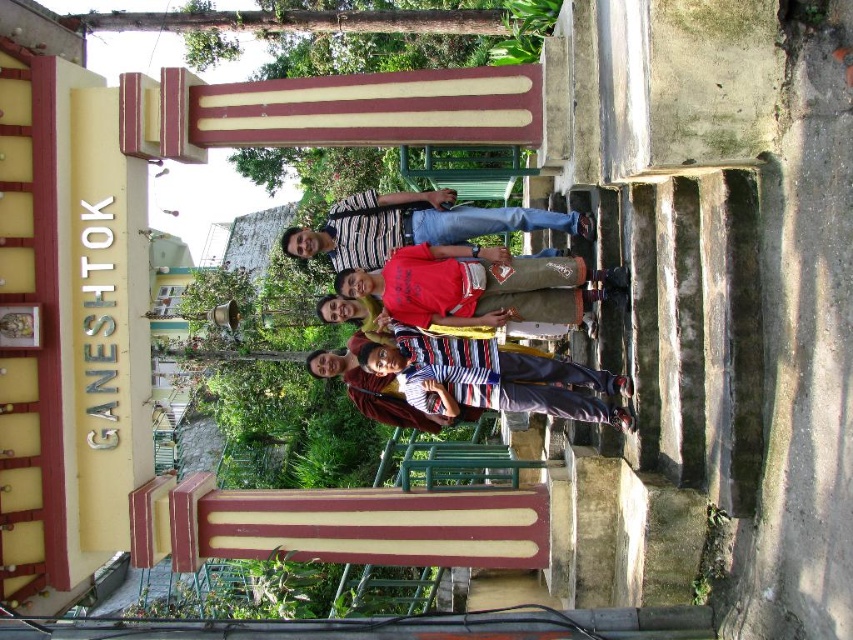
You are trying to identify which striped shirt is narrower in the image. The scene shows a group of people at the entrance of Ganeshtok with a yellow signboard. You see both the striped fabric shirt at center and the striped shirt at center. Which one is narrower?

The striped fabric shirt at center is narrower than the striped shirt at center.